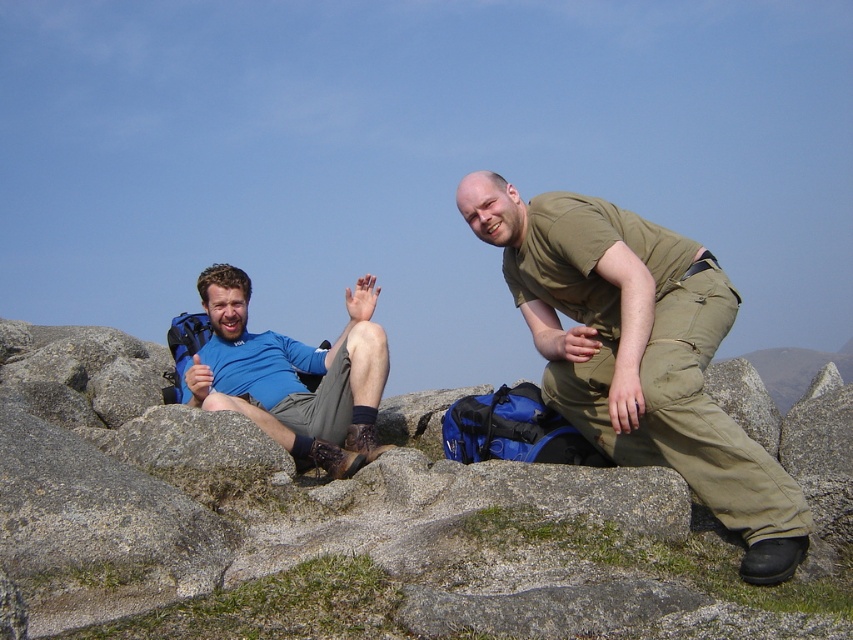
Question: Which object appears farthest from the camera in this image?

Choices:
 (A) blue fabric shirt at left
 (B) olive green fabric pants at center

Answer: (A)

Question: Where is olive green fabric pants at center located in relation to blue fabric shirt at left in the image?

Choices:
 (A) above
 (B) below

Answer: (A)

Question: Does olive green fabric pants at center have a smaller size compared to blue fabric shirt at left?

Choices:
 (A) yes
 (B) no

Answer: (B)

Question: Is olive green fabric pants at center to the right of blue fabric shirt at left from the viewer's perspective?

Choices:
 (A) no
 (B) yes

Answer: (B)

Question: Which point appears farthest from the camera in this image?

Choices:
 (A) (242, 353)
 (B) (641, 433)

Answer: (A)